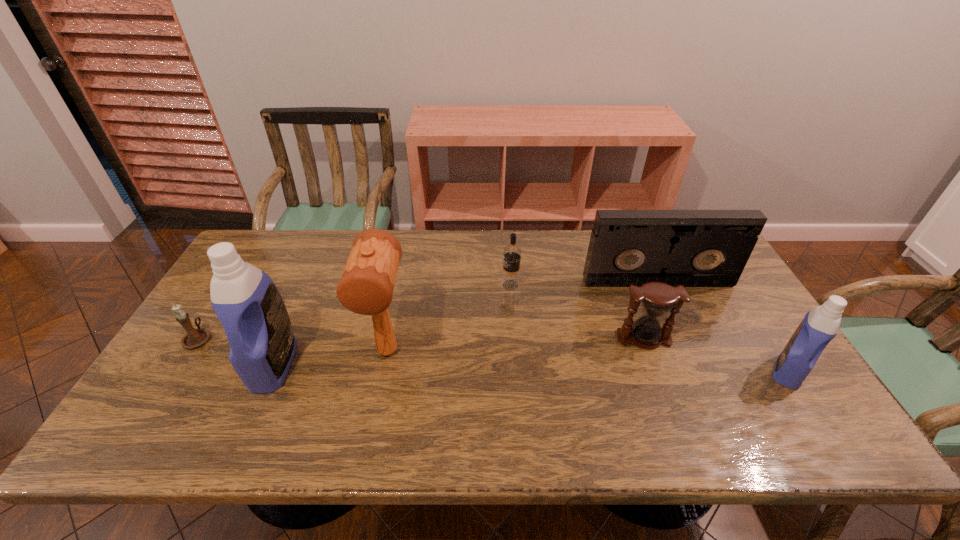
The height and width of the screenshot is (540, 960). Identify the location of free space that satisfies the following two spatial constraints: 1. on the strike surface of the mallet; 2. on the right side of the right detergent. (384, 371).

This screenshot has height=540, width=960. In order to click on free location that satisfies the following two spatial constraints: 1. on the label of the vodka; 2. on the right side of the hourglass in this screenshot , I will do `click(515, 338)`.